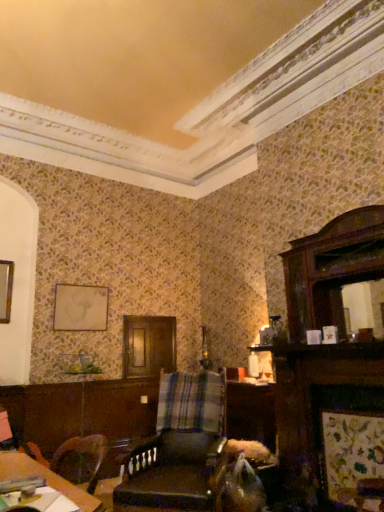
Question: From a real-world perspective, is matte gold picture frame at upper left physically below leather at center?

Choices:
 (A) yes
 (B) no

Answer: (B)

Question: Is matte gold picture frame at upper left turned away from leather at center?

Choices:
 (A) no
 (B) yes

Answer: (A)

Question: From the image's perspective, is matte gold picture frame at upper left located above leather at center?

Choices:
 (A) no
 (B) yes

Answer: (B)

Question: Is matte gold picture frame at upper left not close to leather at center?

Choices:
 (A) yes
 (B) no

Answer: (A)

Question: Is matte gold picture frame at upper left positioned before leather at center?

Choices:
 (A) no
 (B) yes

Answer: (A)

Question: Is matte gold picture frame at upper left to the right of leather at center from the viewer's perspective?

Choices:
 (A) yes
 (B) no

Answer: (B)

Question: Is wooden table at lower left closer to the viewer compared to leather at center?

Choices:
 (A) yes
 (B) no

Answer: (A)

Question: Does wooden table at lower left have a lesser width compared to leather at center?

Choices:
 (A) yes
 (B) no

Answer: (A)

Question: Can you confirm if wooden table at lower left is positioned to the right of leather at center?

Choices:
 (A) yes
 (B) no

Answer: (B)

Question: Is wooden table at lower left bigger than leather at center?

Choices:
 (A) no
 (B) yes

Answer: (A)

Question: Can you confirm if wooden table at lower left is positioned to the left of leather at center?

Choices:
 (A) no
 (B) yes

Answer: (B)

Question: From the image's perspective, is wooden table at lower left on top of leather at center?

Choices:
 (A) no
 (B) yes

Answer: (B)

Question: Considering the relative sizes of wooden table at lower left and matte gold picture frame at upper left in the image provided, is wooden table at lower left wider than matte gold picture frame at upper left?

Choices:
 (A) yes
 (B) no

Answer: (A)